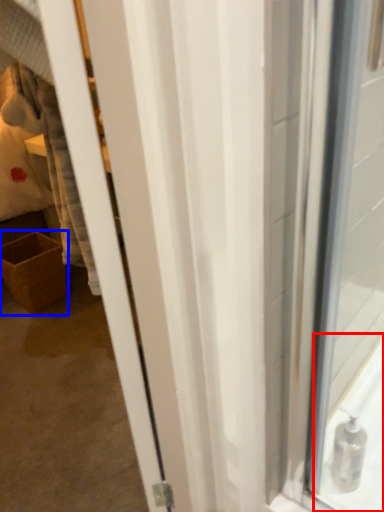
Question: Which of the following is the closest to the observer, bath (highlighted by a red box) or basket (highlighted by a blue box)?

Choices:
 (A) bath
 (B) basket

Answer: (A)